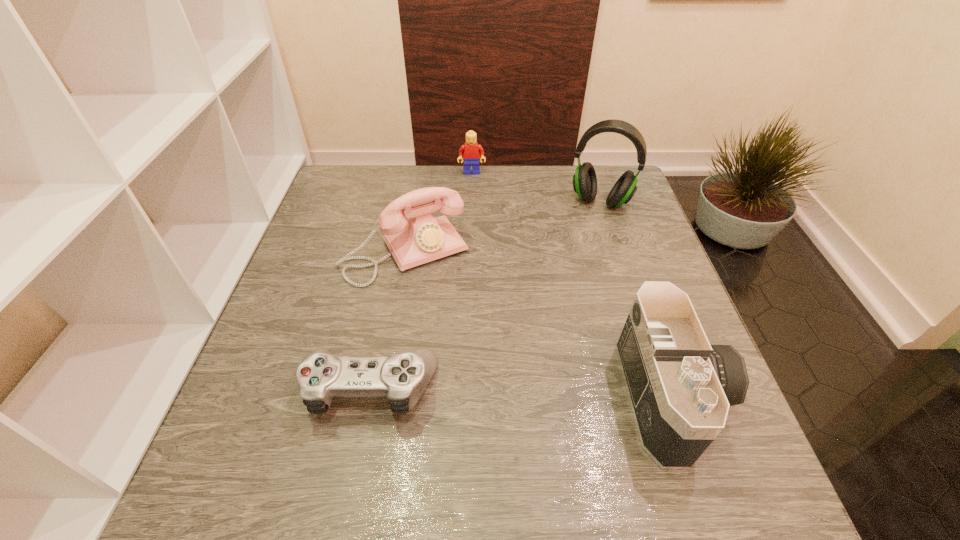
Where is `free space on the desktop that is between the shortest object and the camera and is positioned on the ear cups of the headset`? The height and width of the screenshot is (540, 960). free space on the desktop that is between the shortest object and the camera and is positioned on the ear cups of the headset is located at coordinates click(x=530, y=392).

Locate an element on the screen. The height and width of the screenshot is (540, 960). vacant space on the desktop that is between the control and the camera and is positioned on the dial of the third nearest object is located at coordinates (485, 391).

This screenshot has width=960, height=540. I want to click on vacant space on the desktop that is between the shortest object and the camera and is positioned on the face of the Lego, so click(477, 390).